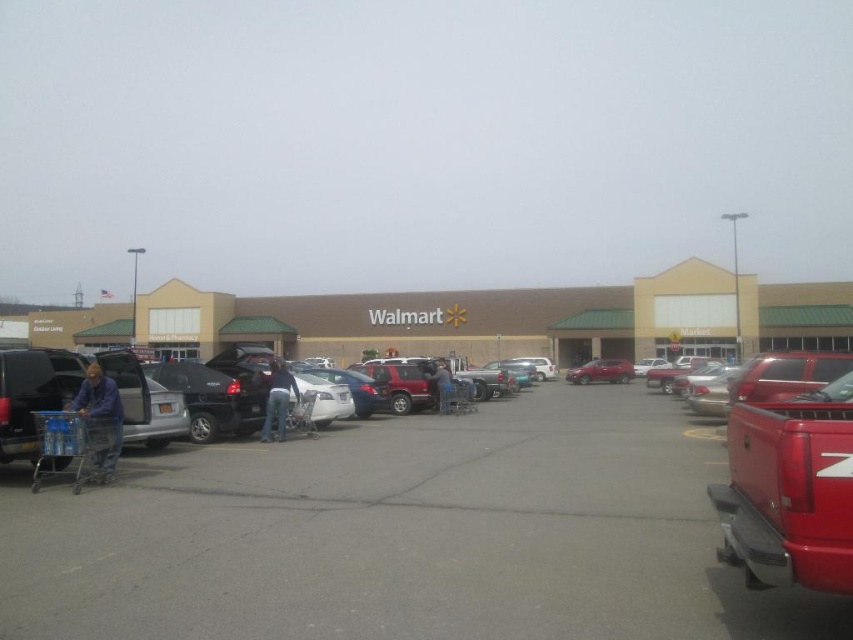
Is red matte truck at right closer to the viewer compared to blue jeans at center?

Yes, it is in front of blue jeans at center.

Is red matte truck at right to the left of blue jeans at center from the viewer's perspective?

No, red matte truck at right is not to the left of blue jeans at center.

Find the location of a particular element. The image size is (853, 640). red matte truck at right is located at coordinates (788, 490).

Can you confirm if red matte truck at right is shorter than metallic silver shopping cart at center?

Indeed, red matte truck at right has a lesser height compared to metallic silver shopping cart at center.

Is the position of red matte truck at right more distant than that of metallic silver shopping cart at center?

No.

Identify the location of red matte truck at right. This screenshot has height=640, width=853. click(788, 490).

Find the location of a particular element. red matte truck at right is located at coordinates (788, 490).

Who is shorter, red matte truck at right or blue denim jeans at lower left?

With less height is red matte truck at right.

Find the location of a particular element. This screenshot has height=640, width=853. red matte truck at right is located at coordinates (x=788, y=490).

Identify the location of red matte truck at right. This screenshot has height=640, width=853. (788, 490).